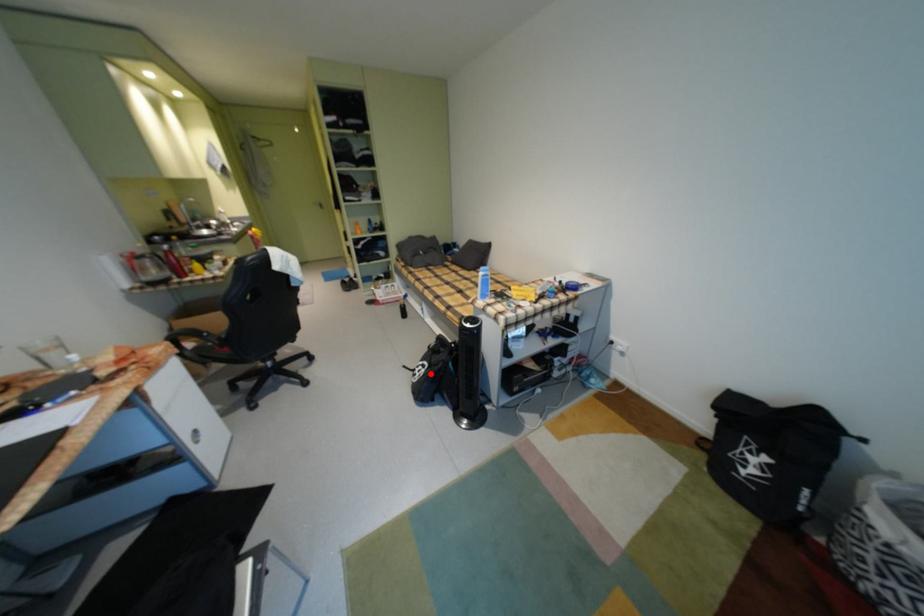
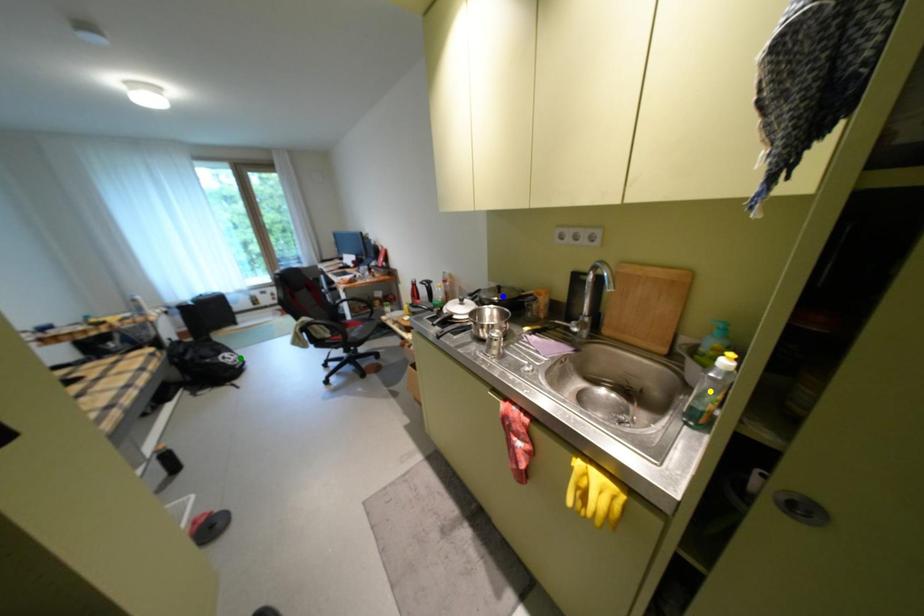
Question: I am providing you with two images of the same scene from different viewpoints. A red point is marked on the first image. You are given multiple points on the second image. Which point in image 2 is actually the same real-world point as the red point in image 1?

Choices:
 (A) blue point
 (B) yellow point
 (C) green point

Answer: (C)